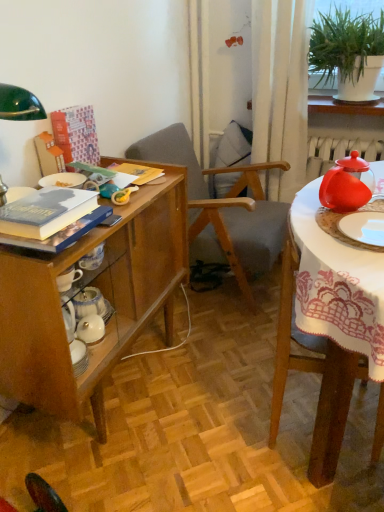
Where is `free spot to the right of wooden desk at left`? free spot to the right of wooden desk at left is located at coordinates (218, 379).